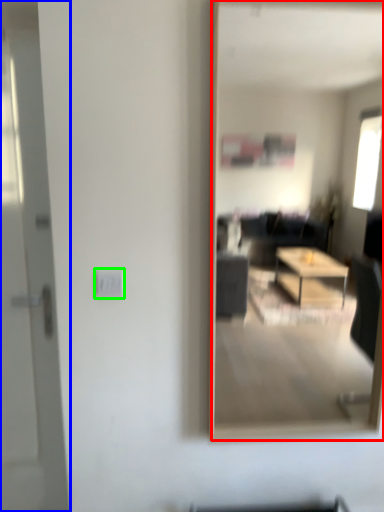
Question: Which is farther away from mirror (highlighted by a red box)? door (highlighted by a blue box) or electric outlet (highlighted by a green box)?

Choices:
 (A) door
 (B) electric outlet

Answer: (B)